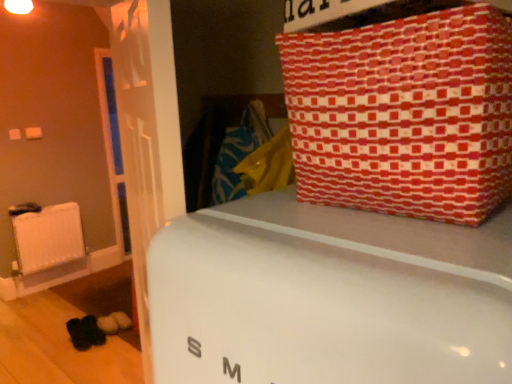
Question: From a real-world perspective, is white glossy refrigerator at center located beneath white matte radiator at left?

Choices:
 (A) no
 (B) yes

Answer: (A)

Question: Is white glossy refrigerator at center thinner than white matte radiator at left?

Choices:
 (A) yes
 (B) no

Answer: (B)

Question: Can you confirm if white glossy refrigerator at center is bigger than white matte radiator at left?

Choices:
 (A) yes
 (B) no

Answer: (A)

Question: Is white glossy refrigerator at center looking in the opposite direction of white matte radiator at left?

Choices:
 (A) yes
 (B) no

Answer: (B)

Question: Is white matte radiator at left surrounded by white glossy refrigerator at center?

Choices:
 (A) yes
 (B) no

Answer: (B)

Question: Is white glossy refrigerator at center wider or thinner than red patterned fabric at upper right?

Choices:
 (A) wide
 (B) thin

Answer: (A)

Question: Would you say white glossy refrigerator at center is to the left or to the right of red patterned fabric at upper right in the picture?

Choices:
 (A) left
 (B) right

Answer: (A)

Question: Is white glossy refrigerator at center bigger or smaller than red patterned fabric at upper right?

Choices:
 (A) small
 (B) big

Answer: (B)

Question: From a real-world perspective, is white glossy refrigerator at center positioned above or below red patterned fabric at upper right?

Choices:
 (A) above
 (B) below

Answer: (B)

Question: In terms of width, does red patterned fabric at upper right look wider or thinner when compared to white matte radiator at left?

Choices:
 (A) wide
 (B) thin

Answer: (A)

Question: Is red patterned fabric at upper right situated inside white matte radiator at left or outside?

Choices:
 (A) inside
 (B) outside

Answer: (B)

Question: Would you say red patterned fabric at upper right is to the left or to the right of white matte radiator at left in the picture?

Choices:
 (A) left
 (B) right

Answer: (B)

Question: In terms of size, does red patterned fabric at upper right appear bigger or smaller than white matte radiator at left?

Choices:
 (A) small
 (B) big

Answer: (B)

Question: Is white matte radiator at left in front of or behind white glossy refrigerator at center in the image?

Choices:
 (A) behind
 (B) front

Answer: (A)

Question: Considering the positions of point (31, 271) and point (286, 299), is point (31, 271) closer or farther from the camera than point (286, 299)?

Choices:
 (A) farther
 (B) closer

Answer: (A)